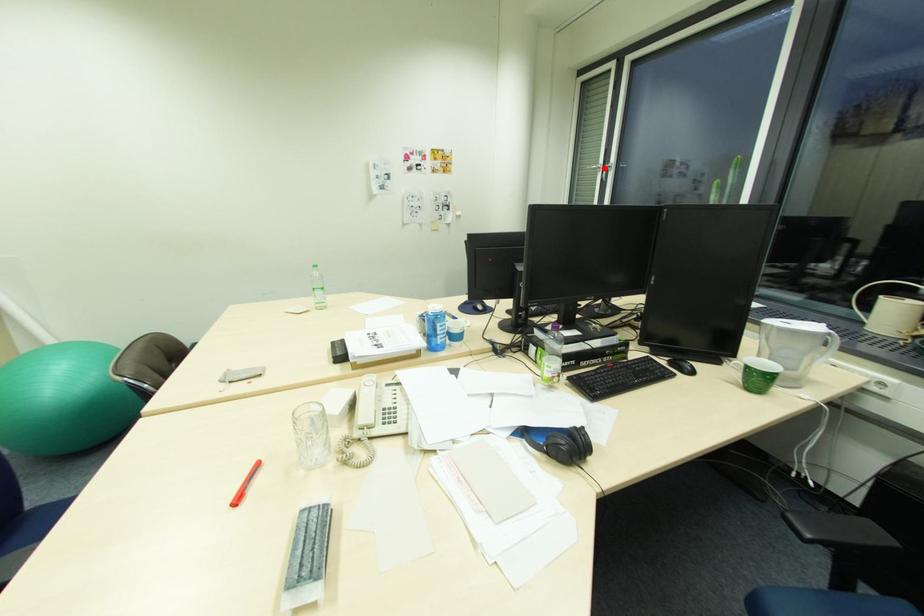
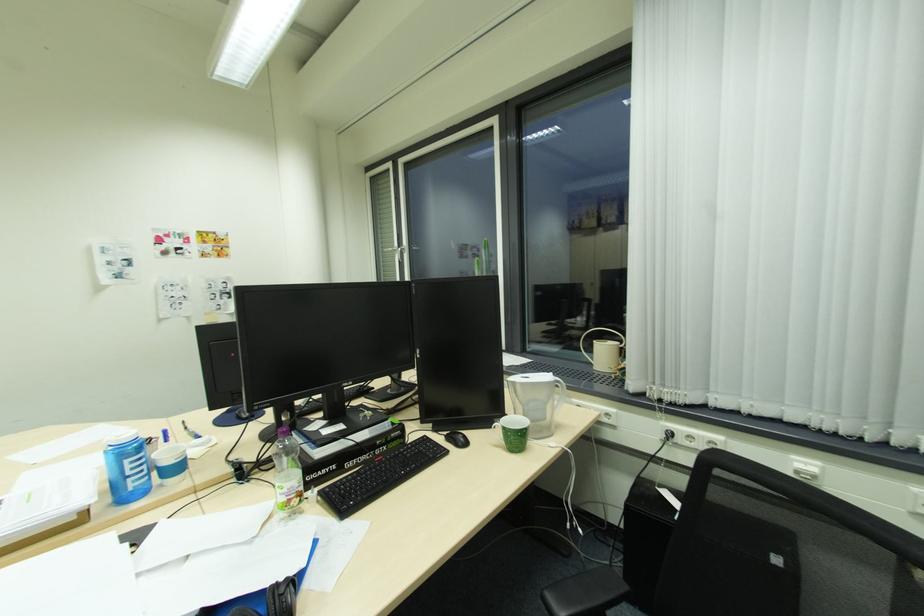
The point at the highlighted location is marked in the first image. Where is the corresponding point in the second image?

(400, 251)